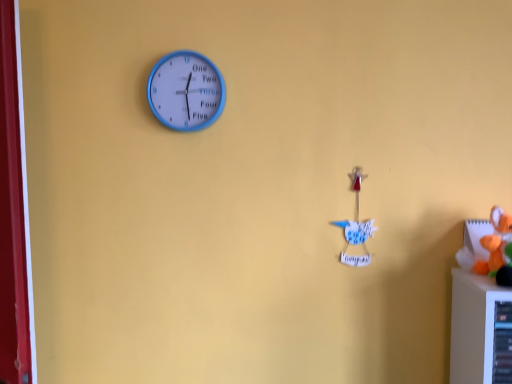
Question: Considering the positions of white paper bird at center-right, positioned as the 2th toy in front-to-back order, and blue plastic clock at upper left in the image, is white paper bird at center-right, positioned as the 2th toy in front-to-back order, bigger or smaller than blue plastic clock at upper left?

Choices:
 (A) big
 (B) small

Answer: (B)

Question: From a real-world perspective, relative to blue plastic clock at upper left, is white paper bird at center-right, positioned as the 2th toy in front-to-back order, vertically above or below?

Choices:
 (A) below
 (B) above

Answer: (A)

Question: Which is farther from the white paper bird at center-right, the 1th toy in the back-to-front sequence?

Choices:
 (A) blue plastic clock at upper left
 (B) orange plush toy at right, which ranks as the 1th toy in front-to-back order

Answer: (A)

Question: Considering the real-world distances, which object is farthest from the blue plastic clock at upper left?

Choices:
 (A) white paper bird at center-right, positioned as the 2th toy in front-to-back order
 (B) orange plush toy at right, which appears as the second toy when viewed from the back

Answer: (B)